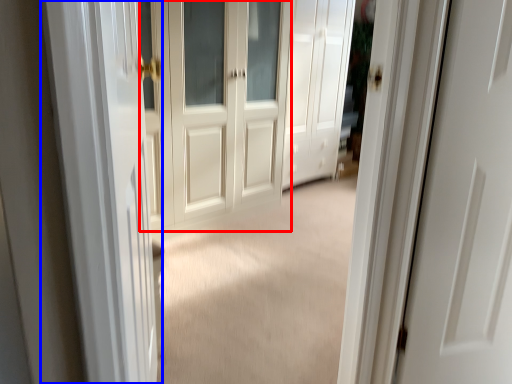
Question: Which point is closer to the camera, door (highlighted by a red box) or screen door (highlighted by a blue box)?

Choices:
 (A) door
 (B) screen door

Answer: (B)